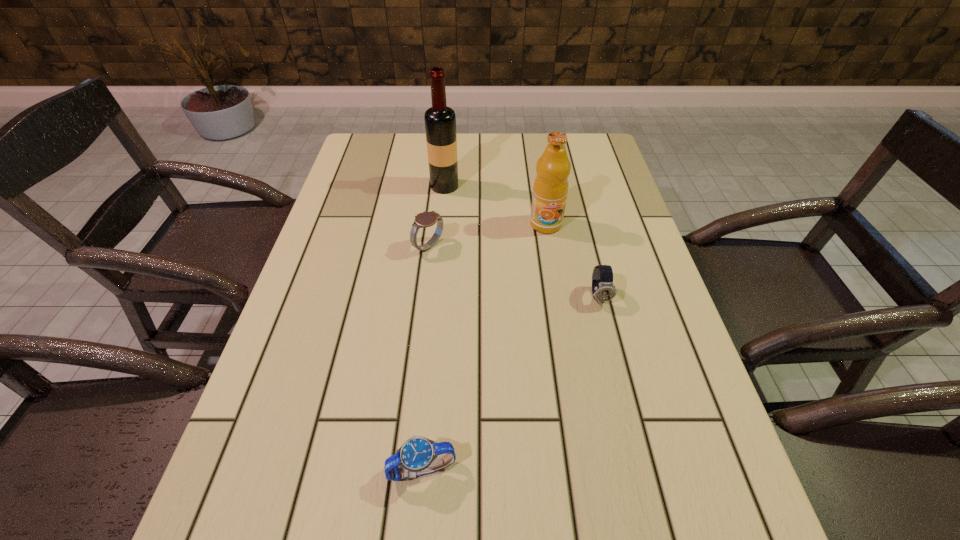
Find the location of `object that stands as the second closest to the rightmost watch`. object that stands as the second closest to the rightmost watch is located at coordinates (425, 219).

Identify which watch is the nearest to the fourth shortest object. Please provide its 2D coordinates. Your answer should be formatted as a tuple, i.e. [(x, y)], where the tuple contains the x and y coordinates of a point satisfying the conditions above.

[(603, 289)]

Locate which watch ranks second in proximity to the second tallest object. Please provide its 2D coordinates. Your answer should be formatted as a tuple, i.e. [(x, y)], where the tuple contains the x and y coordinates of a point satisfying the conditions above.

[(425, 219)]

Identify the location of vacant space that satisfies the following two spatial constraints: 1. on the front side of the shortest watch; 2. on the right side of the wine bottle. (417, 470).